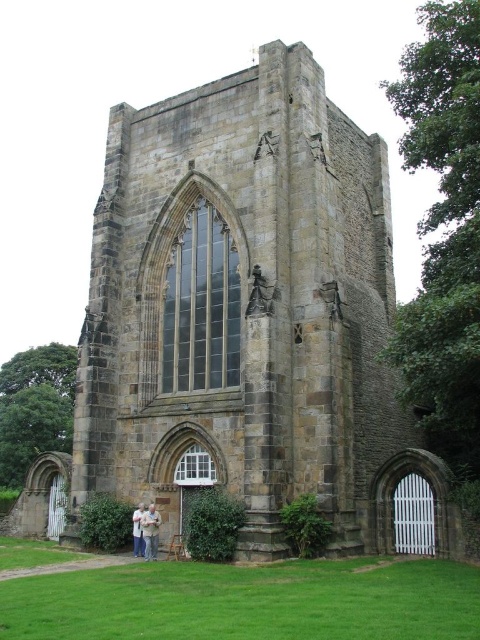
Which is behind, point (86, 618) or point (136, 513)?

The point (136, 513) is more distant.

Measure the distance between green grass at lower center and camera.

green grass at lower center and camera are 26.89 meters apart from each other.

Is point (309, 588) farther from viewer compared to point (140, 548)?

No.

Locate an element on the screen. Image resolution: width=480 pixels, height=640 pixels. green grass at lower center is located at coordinates (248, 602).

Who is more distant from viewer, (451,611) or (146,516)?

The point (146,516) is behind.

The image size is (480, 640). What do you see at coordinates (248, 602) in the screenshot?
I see `green grass at lower center` at bounding box center [248, 602].

Identify the location of green grass at lower center. (248, 602).

Who is more distant from viewer, (x=151, y=552) or (x=141, y=508)?

The point (x=141, y=508) is more distant.

You are a GUI agent. You are given a task and a screenshot of the screen. Output one action in this format:
    pyautogui.click(x=<x>, y=<y>)
    Task: Click on the light brown wooden couple at lower center
    
    Given the screenshot: What is the action you would take?
    pyautogui.click(x=145, y=531)